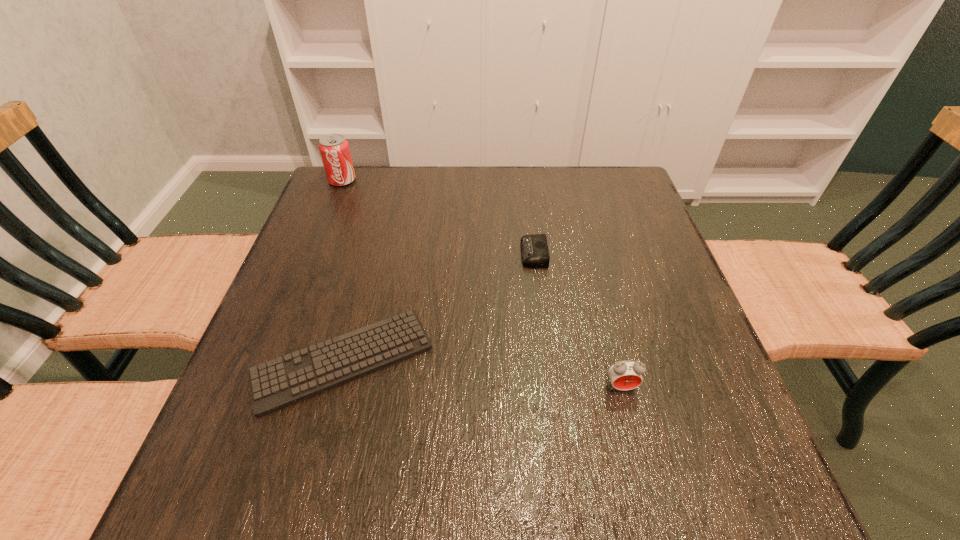
Where is `vacant space located 0.150m on the display of the second farthest object`? The height and width of the screenshot is (540, 960). vacant space located 0.150m on the display of the second farthest object is located at coordinates pos(458,254).

The height and width of the screenshot is (540, 960). What are the coordinates of `vacant area situated 0.080m on the display of the second farthest object` in the screenshot? It's located at (488, 254).

Find the location of a particular element. free point located 0.060m on the front of the computer keyboard is located at coordinates (320, 453).

Locate an element on the screen. The width and height of the screenshot is (960, 540). object that is at the far edge is located at coordinates (334, 149).

What are the coordinates of `soda can located in the left edge section of the desktop` in the screenshot? It's located at (334, 149).

You are a GUI agent. You are given a task and a screenshot of the screen. Output one action in this format:
    pyautogui.click(x=<x>, y=<y>)
    Task: Click on the computer keyboard situated at the left edge
    Image resolution: width=960 pixels, height=540 pixels.
    Given the screenshot: What is the action you would take?
    pyautogui.click(x=281, y=382)

Where is `object that is at the right edge`? This screenshot has height=540, width=960. object that is at the right edge is located at coordinates (625, 375).

You are a GUI agent. You are given a task and a screenshot of the screen. Output one action in this format:
    pyautogui.click(x=<x>, y=<y>)
    Task: Click on the object that is at the far left corner
    
    Given the screenshot: What is the action you would take?
    pyautogui.click(x=334, y=149)

You are a GUI agent. You are given a task and a screenshot of the screen. Output one action in this format:
    pyautogui.click(x=<x>, y=<y>)
    Task: Click on the free region at the far edge of the desktop
    This screenshot has width=960, height=540.
    Given the screenshot: What is the action you would take?
    pyautogui.click(x=492, y=194)

Where is `vacant area at the near edge`? The image size is (960, 540). vacant area at the near edge is located at coordinates (498, 453).